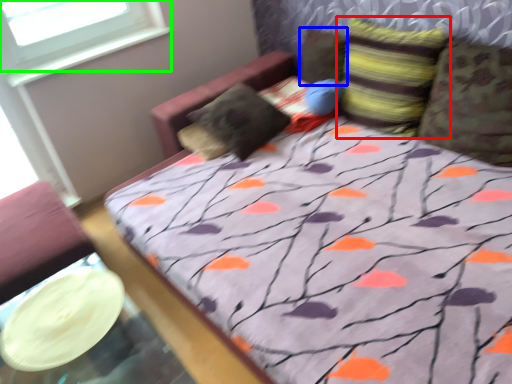
Question: Which object is the farthest from pillow (highlighted by a red box)? Choose among these: pillow (highlighted by a blue box) or window (highlighted by a green box).

Choices:
 (A) pillow
 (B) window

Answer: (B)